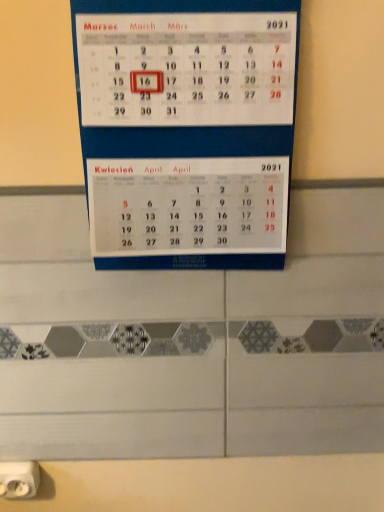
Question: Is white plastic power plugs and sockets at lower left situated inside white paper calendar at center or outside?

Choices:
 (A) outside
 (B) inside

Answer: (A)

Question: From the image's perspective, is white plastic power plugs and sockets at lower left above or below white paper calendar at center?

Choices:
 (A) above
 (B) below

Answer: (B)

Question: In terms of size, does white plastic power plugs and sockets at lower left appear bigger or smaller than white paper calendar at center?

Choices:
 (A) small
 (B) big

Answer: (A)

Question: Would you say white paper calendar at center is to the left or to the right of white plastic power plugs and sockets at lower left in the picture?

Choices:
 (A) right
 (B) left

Answer: (A)

Question: Is white paper calendar at center in front of or behind white plastic power plugs and sockets at lower left in the image?

Choices:
 (A) front
 (B) behind

Answer: (A)

Question: From the image's perspective, is white paper calendar at center positioned above or below white plastic power plugs and sockets at lower left?

Choices:
 (A) above
 (B) below

Answer: (A)

Question: Is point (142, 58) closer or farther from the camera than point (36, 472)?

Choices:
 (A) closer
 (B) farther

Answer: (A)